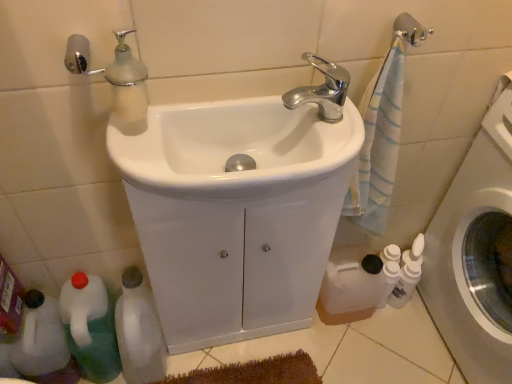
Where is `free space in front of white glossy bottles at lower right`? free space in front of white glossy bottles at lower right is located at coordinates (401, 343).